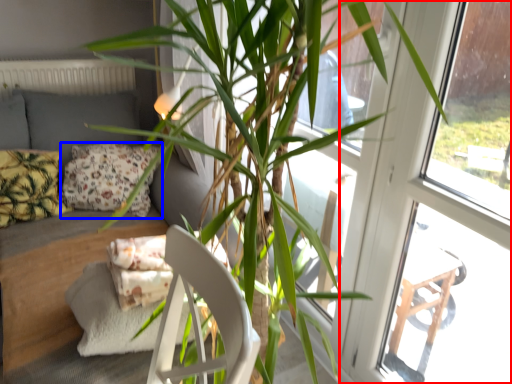
Question: Among these objects, which one is nearest to the camera, screen door (highlighted by a red box) or pillow (highlighted by a blue box)?

Choices:
 (A) screen door
 (B) pillow

Answer: (A)